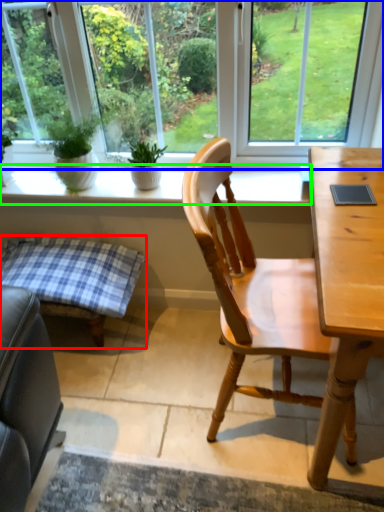
Question: Which object is the closest to the table (highlighted by a red box)? Choose among these: window (highlighted by a blue box) or window sill (highlighted by a green box).

Choices:
 (A) window
 (B) window sill

Answer: (B)